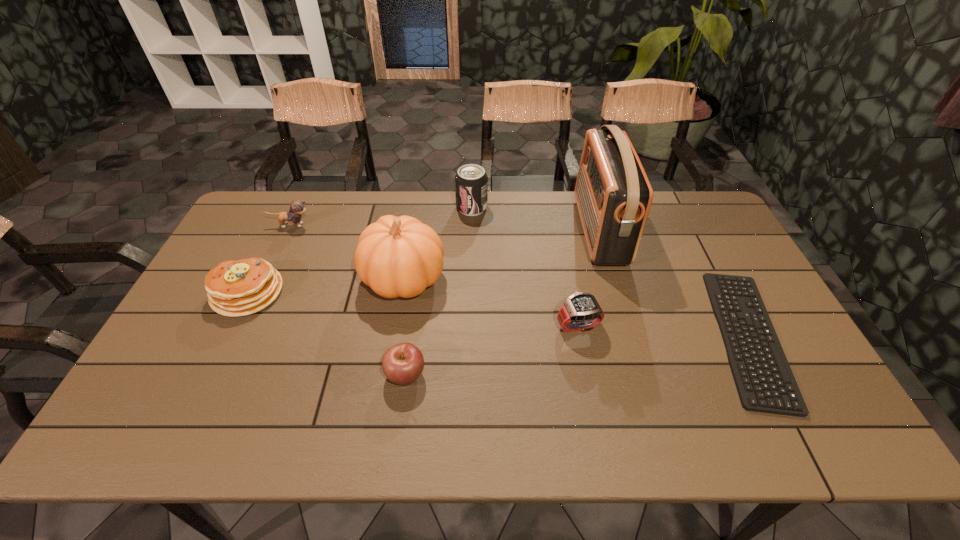
Locate an element on the screen. Image resolution: width=960 pixels, height=540 pixels. radio receiver is located at coordinates (613, 194).

Where is `the second object from right to left`? The height and width of the screenshot is (540, 960). the second object from right to left is located at coordinates pyautogui.click(x=613, y=194).

The height and width of the screenshot is (540, 960). In order to click on the second tallest object in this screenshot , I will do `click(400, 256)`.

Where is `soda can`? soda can is located at coordinates (471, 182).

This screenshot has height=540, width=960. Identify the location of the fifth object from left to right. (471, 182).

Identify the location of kitten. (297, 208).

The width and height of the screenshot is (960, 540). I want to click on pancake, so click(x=234, y=288).

Locate an element on the screen. This screenshot has width=960, height=540. the third object from right to left is located at coordinates (580, 312).

Find the location of a particular element. The image size is (960, 540). the second shortest object is located at coordinates (402, 364).

Where is `computer keyboard`? This screenshot has width=960, height=540. computer keyboard is located at coordinates (765, 383).